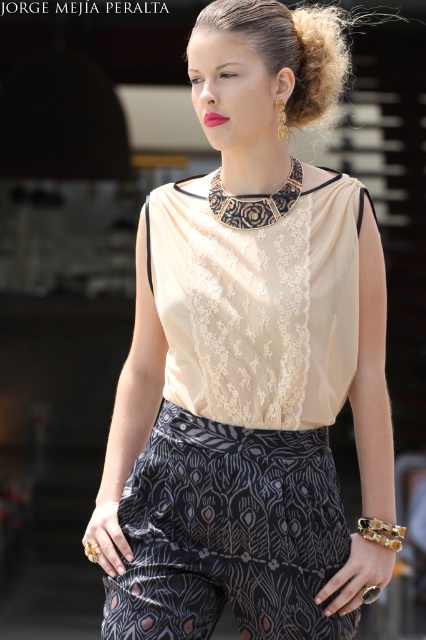
Question: Which of the following is the closest to the observer?

Choices:
 (A) black lace neckband at center
 (B) blonde hair at upper center
 (C) beige satin blouse at center

Answer: (C)

Question: Is dark gray printed pants at center positioned before blonde hair at upper center?

Choices:
 (A) no
 (B) yes

Answer: (B)

Question: Can you confirm if beige satin blouse at center is positioned to the left of black lace neckband at center?

Choices:
 (A) yes
 (B) no

Answer: (A)

Question: Which is nearer to the blonde hair at upper center?

Choices:
 (A) dark gray printed pants at center
 (B) beige satin blouse at center
 (C) black lace neckband at center

Answer: (C)

Question: Which point appears farthest from the camera in this image?

Choices:
 (A) (342, 68)
 (B) (137, 248)
 (C) (264, 225)

Answer: (B)

Question: From the image, what is the correct spatial relationship of beige satin blouse at center in relation to blonde hair at upper center?

Choices:
 (A) above
 (B) below

Answer: (B)